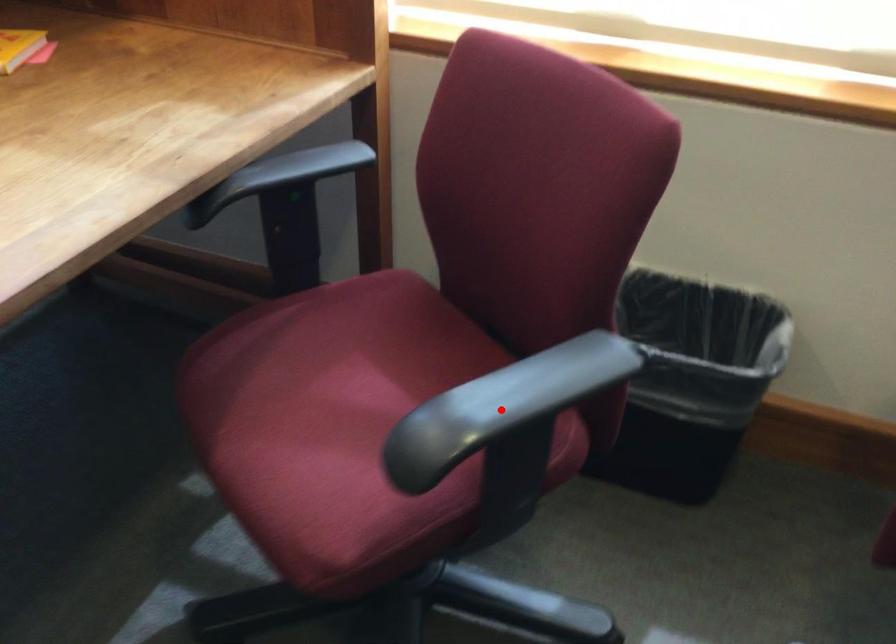
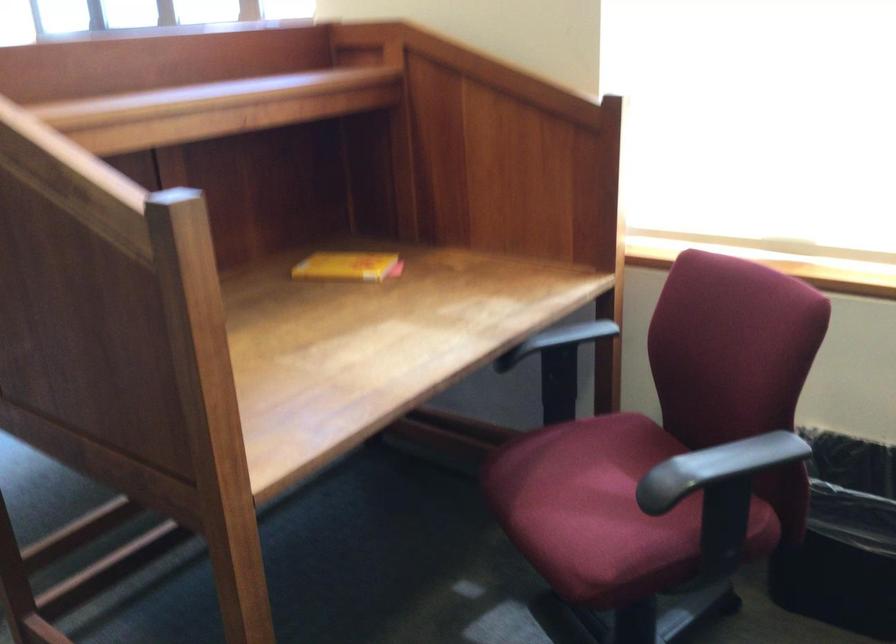
Find the pixel in the second image that matches the highlighted location in the first image.

(716, 468)